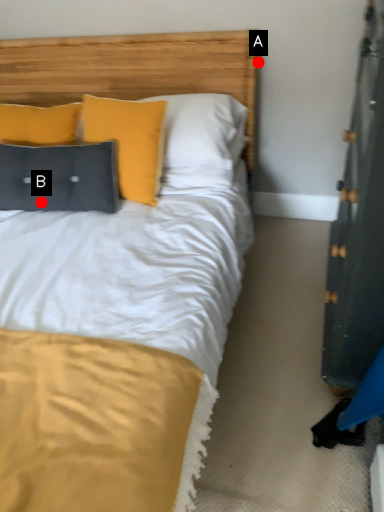
Question: Two points are circled on the image, labeled by A and B beside each circle. Which point is farther to the camera?

Choices:
 (A) A is further
 (B) B is further

Answer: (A)